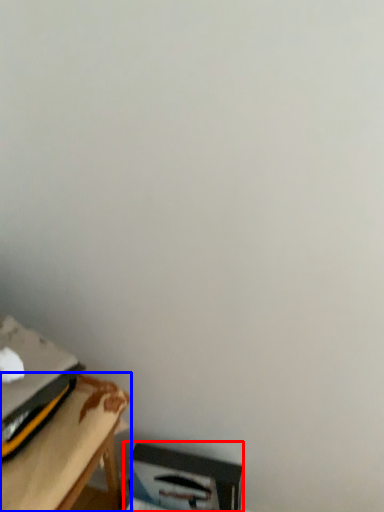
Question: Which point is further to the camera, cardboard box (highlighted by a red box) or table (highlighted by a blue box)?

Choices:
 (A) cardboard box
 (B) table

Answer: (A)